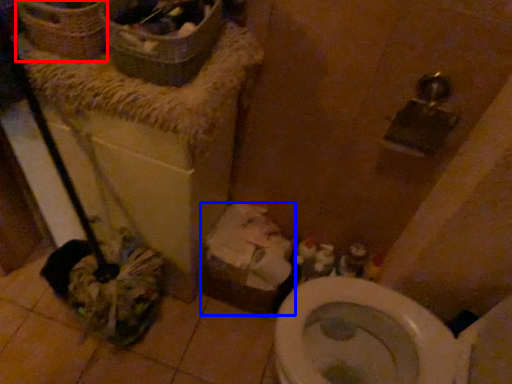
Question: Which object appears closest to the camera in this image, basket (highlighted by a red box) or cardboard box (highlighted by a blue box)?

Choices:
 (A) basket
 (B) cardboard box

Answer: (A)